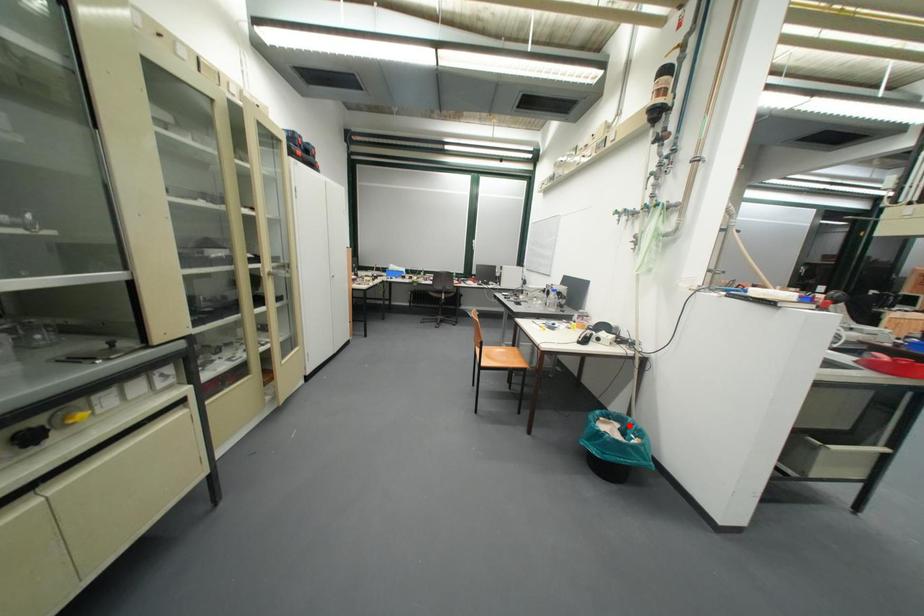
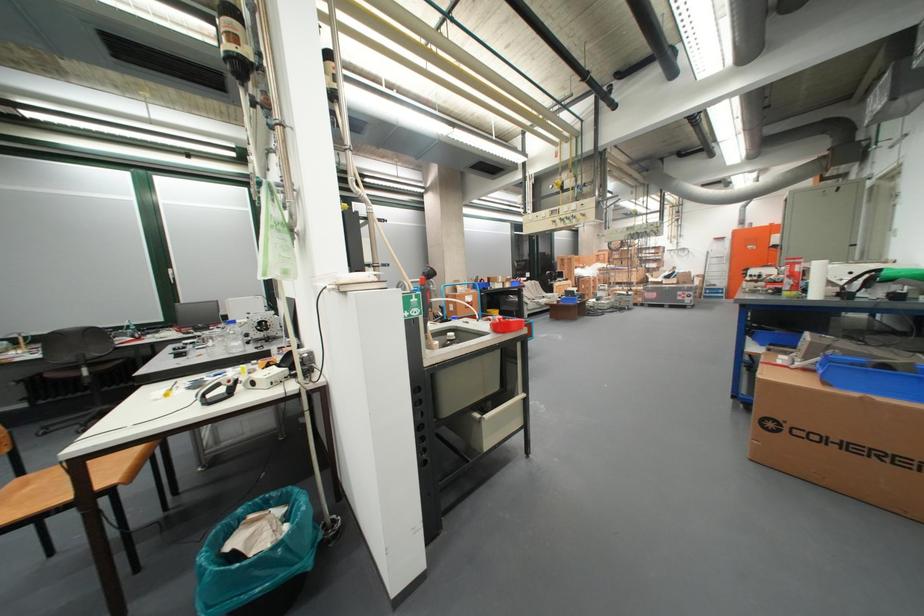
Question: I am providing you with two images of the same scene from different viewpoints. Image1 has a red point marked. In image2, the corresponding 3D location appears at what relative position? Reply with the corresponding letter.

Choices:
 (A) Closer
 (B) Farther

Answer: (B)